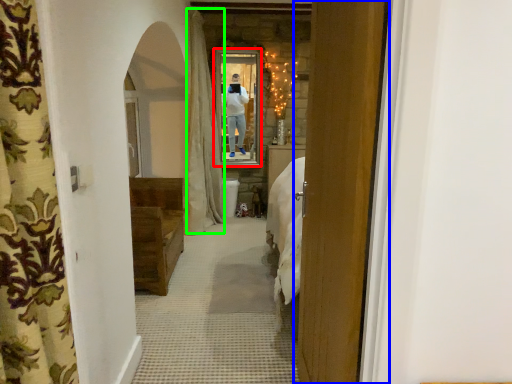
Question: Estimate the real-world distances between objects in this image. Which object is farther from mirror (highlighted by a red box), door (highlighted by a blue box) or curtain (highlighted by a green box)?

Choices:
 (A) door
 (B) curtain

Answer: (A)